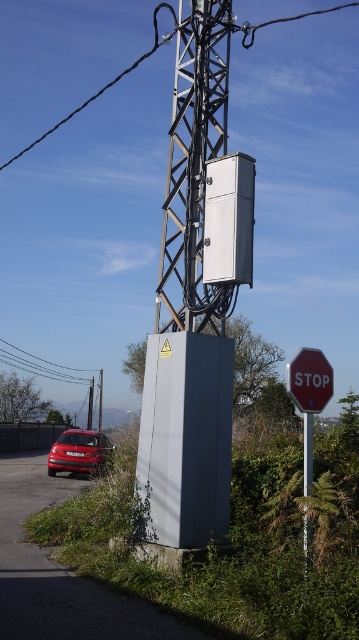
You are a delivery driver who needs to park your metallic red car at lower left near the utility pole and stop sign in the image. Based on the coordinates provided, can you confirm if the car is already positioned correctly at the designated parking spot at point 0.706, 0.220?

Yes, the metallic red car at lower left is positioned correctly at the designated parking spot at point (x=78, y=451) as per the coordinates provided.

You are a photographer trying to capture both the metallic red car at lower left and the gray metallic pole at center in the same frame. Given their sizes, which object should you move closer to in order to include both in your shot without cropping either?

Since the metallic red car at lower left is larger in size than the gray metallic pole at center, you should move closer to the gray metallic pole at center to balance their sizes in the frame.

You are a pedestrian standing at the intersection and see the red matte stop sign at center right and the metallic red car at lower left. Which object appears smaller in the image?

The red matte stop sign at center right appears smaller than the metallic red car at lower left.